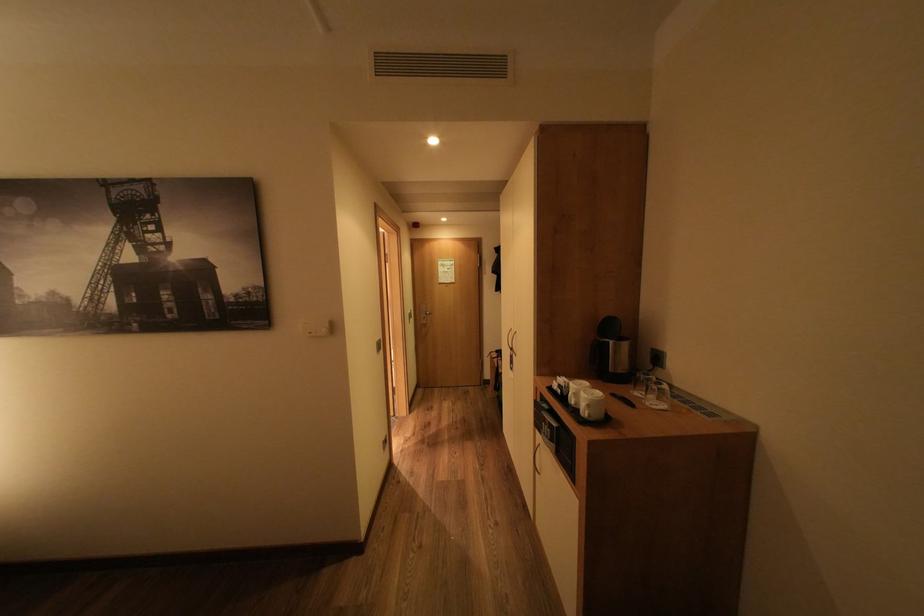
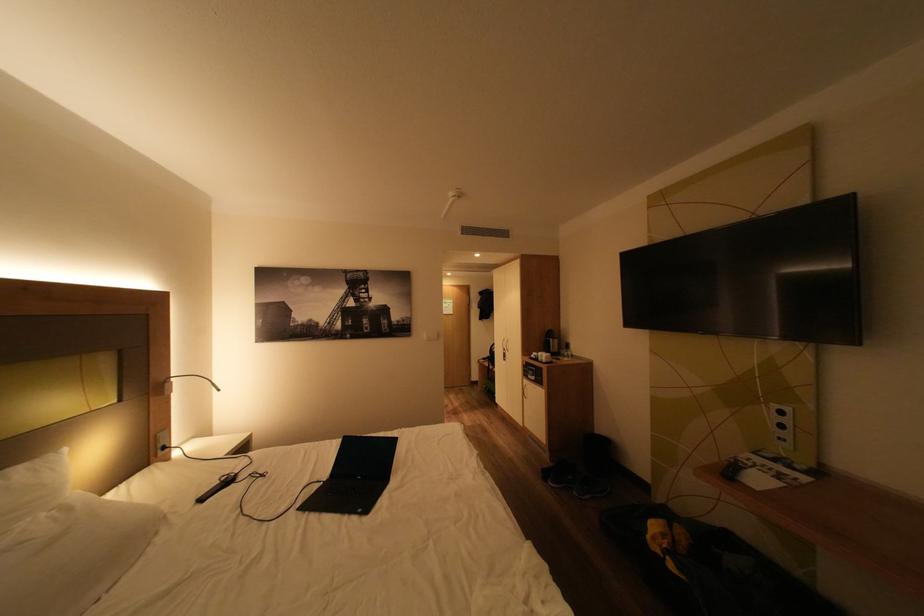
The images are taken continuously from a first-person perspective. In which direction are you moving?

The cameraman moved toward left, backward.